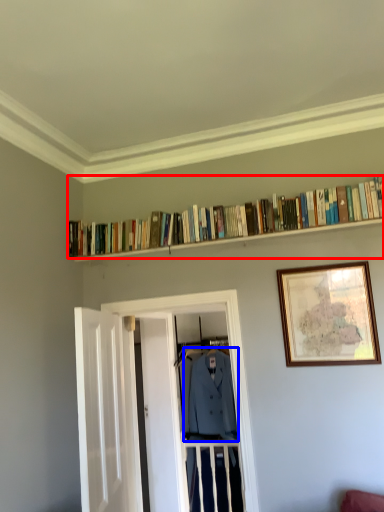
Question: Among these objects, which one is nearest to the camera, book (highlighted by a red box) or clothing (highlighted by a blue box)?

Choices:
 (A) book
 (B) clothing

Answer: (A)